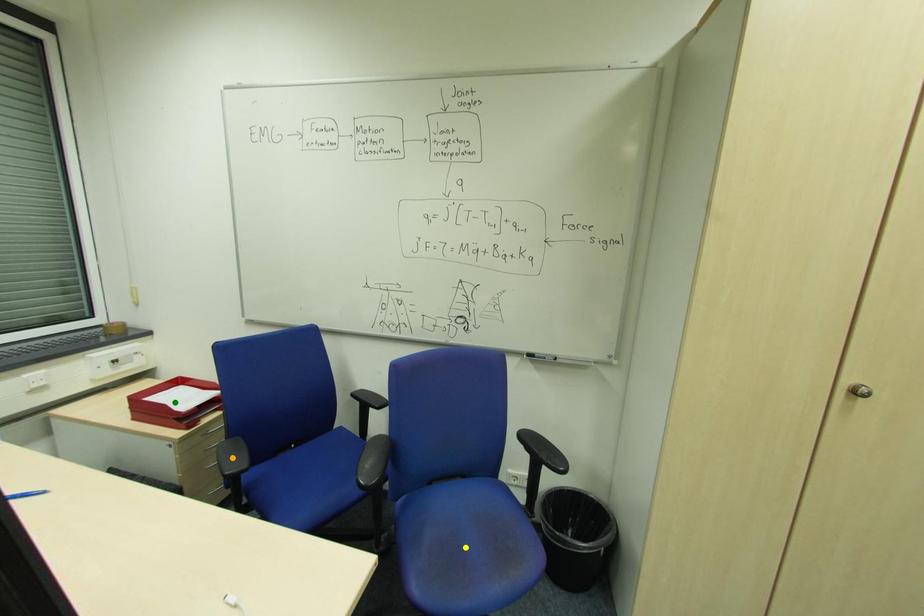
Order these from nearest to farthest:
green point, yellow point, orange point

1. green point
2. yellow point
3. orange point